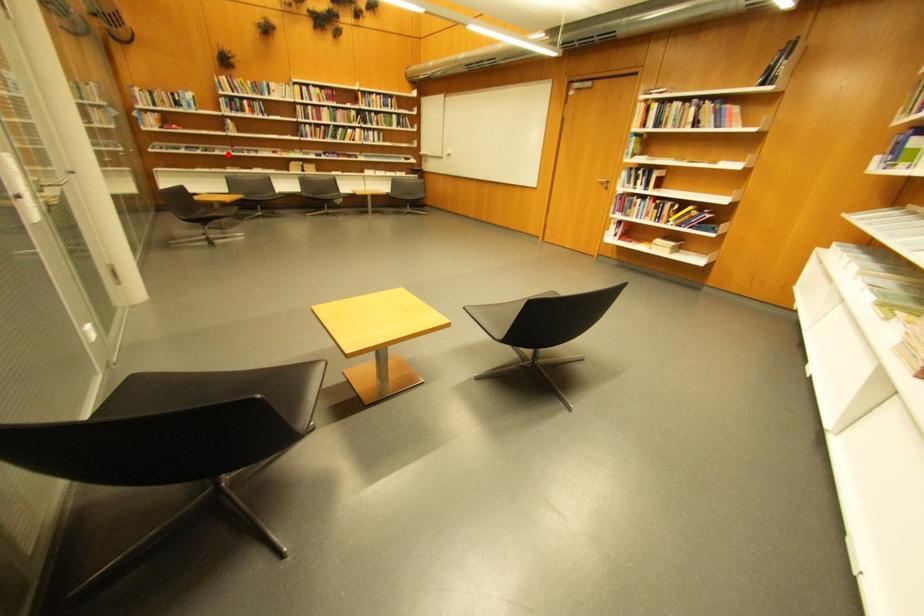
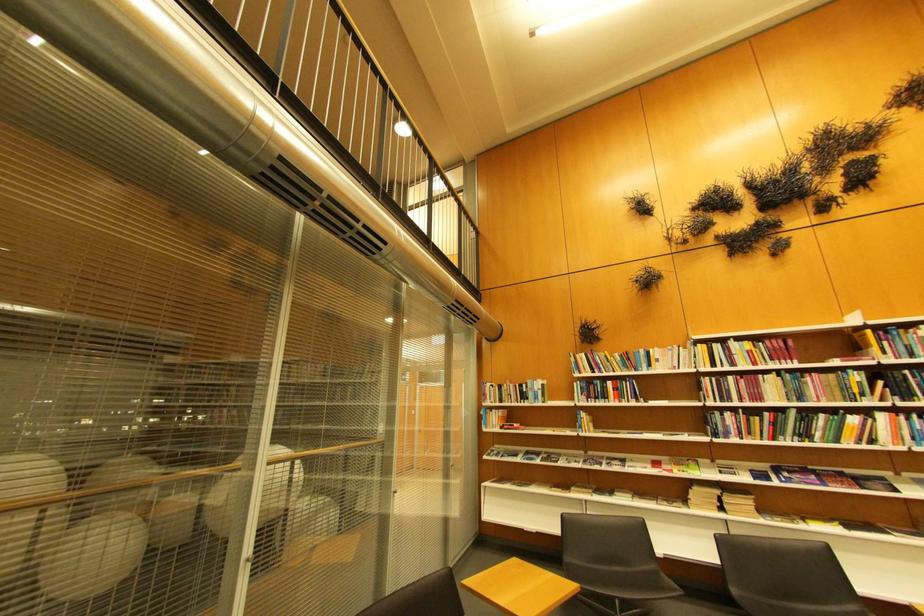
Question: A red point is marked in image1. In image2, is the corresponding 3D point closer to the camera or farther? Reply with the corresponding letter.

Choices:
 (A) The corresponding 3D point is closer.
 (B) The corresponding 3D point is farther.

Answer: (B)